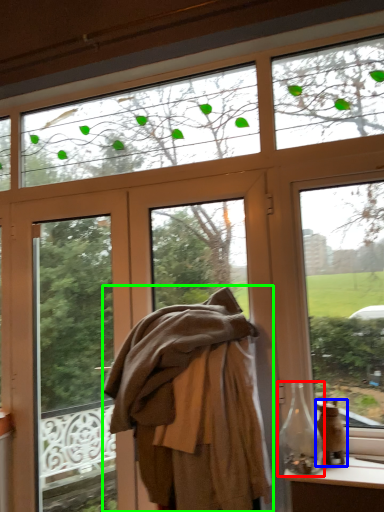
Question: Considering the real-world distances, which object is farthest from bottle (highlighted by a red box)? glass vase (highlighted by a blue box) or clothing (highlighted by a green box)?

Choices:
 (A) glass vase
 (B) clothing

Answer: (B)